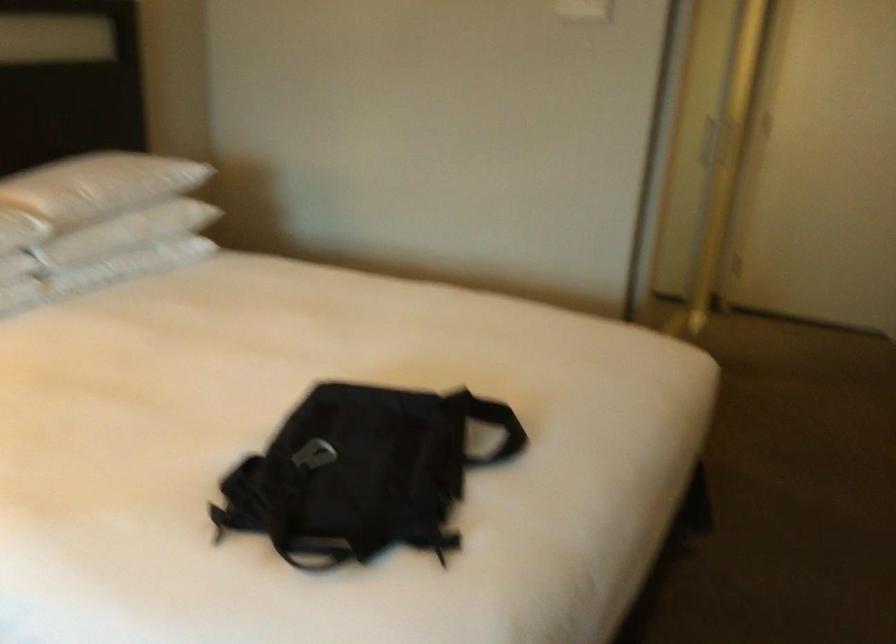
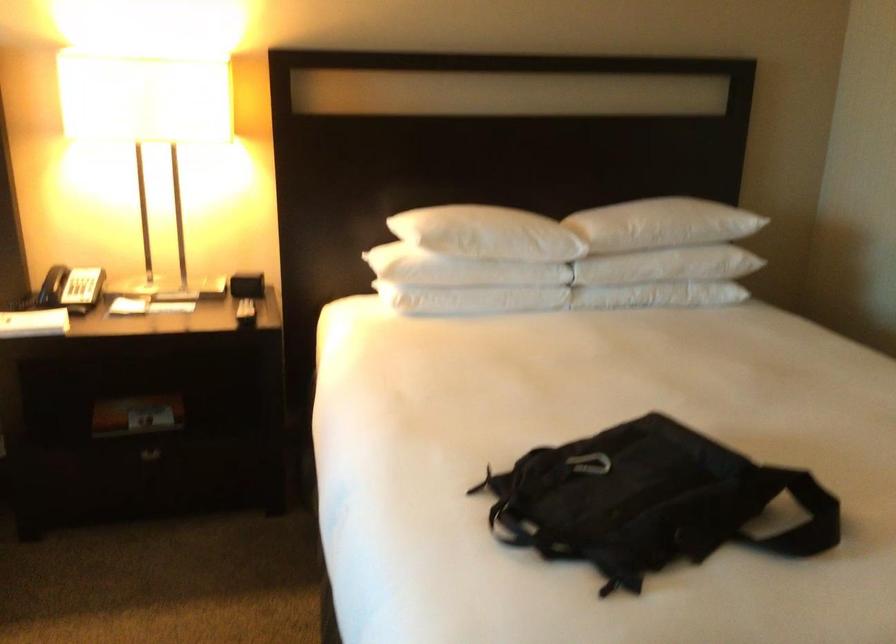
The point at (409, 465) is marked in the first image. Where is the corresponding point in the second image?

(649, 502)